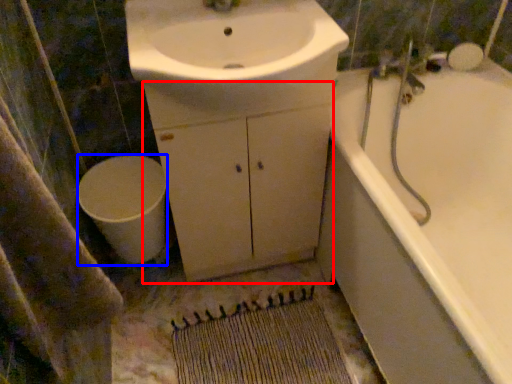
Question: Which object is further to the camera taking this photo, cabinetry (highlighted by a red box) or toilet (highlighted by a blue box)?

Choices:
 (A) cabinetry
 (B) toilet

Answer: (B)